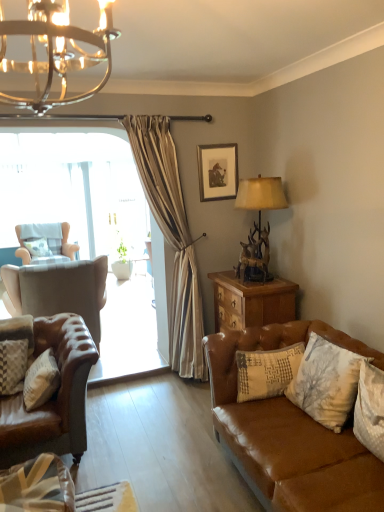
Question: Relative to brown wood nightstand at right, is brown leather couch at lower right in front or behind?

Choices:
 (A) front
 (B) behind

Answer: (A)

Question: Choose the correct answer: Is brown leather couch at lower right inside brown wood nightstand at right or outside it?

Choices:
 (A) outside
 (B) inside

Answer: (A)

Question: Estimate the real-world distances between objects in this image. Which object is farther from the textured beige pillow at center right, acting as the third pillow starting from the left?

Choices:
 (A) plaid fabric pillow at lower left, positioned as the first pillow in front-to-back order
 (B) brown leather couch at lower right
 (C) brown wood nightstand at right
 (D) leather armchair at left, acting as the second chair starting from the left
 (E) antique bronze lamp at upper right

Answer: (D)

Question: Based on their relative distances, which object is farther from the brown wood nightstand at right?

Choices:
 (A) white textured pillow at lower right, which is the second pillow in front-to-back order
 (B) leather armchair at left, the second chair in the back-to-front sequence
 (C) antique bronze lamp at upper right
 (D) brown leather couch at lower right
 (E) textured beige pillow at center right, the 2th pillow from the back

Answer: (B)